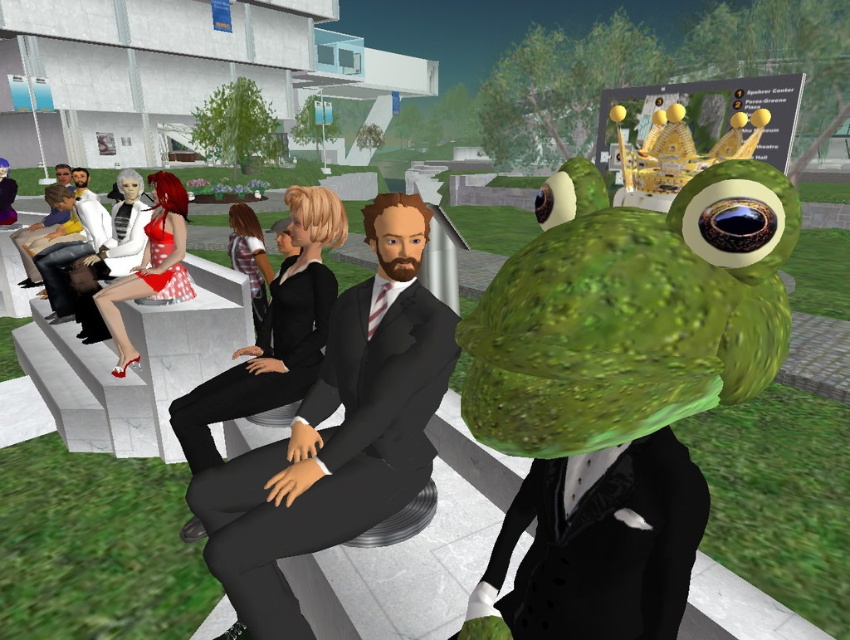
Is green matte/fuzzy frog at center to the right of black matte suit at center from the viewer's perspective?

Indeed, green matte/fuzzy frog at center is positioned on the right side of black matte suit at center.

Can you confirm if green matte/fuzzy frog at center is bigger than black matte suit at center?

No.

This screenshot has height=640, width=850. Describe the element at coordinates (630, 310) in the screenshot. I see `green matte/fuzzy frog at center` at that location.

This screenshot has width=850, height=640. Find the location of `green matte/fuzzy frog at center`. green matte/fuzzy frog at center is located at coordinates click(630, 310).

Is black suit at center closer to camera compared to black matte suit at center?

Yes.

Does black suit at center have a greater width compared to black matte suit at center?

Yes.

Which is in front, point (276, 614) or point (302, 292)?

Point (276, 614)

At what (x,y) coordinates should I click in order to perform the action: click on black suit at center. Please return your answer as a coordinate pair (x, y). The image size is (850, 640). Looking at the image, I should click on (336, 433).

Can you confirm if green matte/fuzzy frog at center is shorter than black suit at center?

Yes.

Which of these two, green matte/fuzzy frog at center or black suit at center, stands taller?

black suit at center is taller.

Does point (483, 342) come behind point (420, 214)?

That is False.

At what (x,y) coordinates should I click in order to perform the action: click on green matte/fuzzy frog at center. Please return your answer as a coordinate pair (x, y). Looking at the image, I should click on (630, 310).